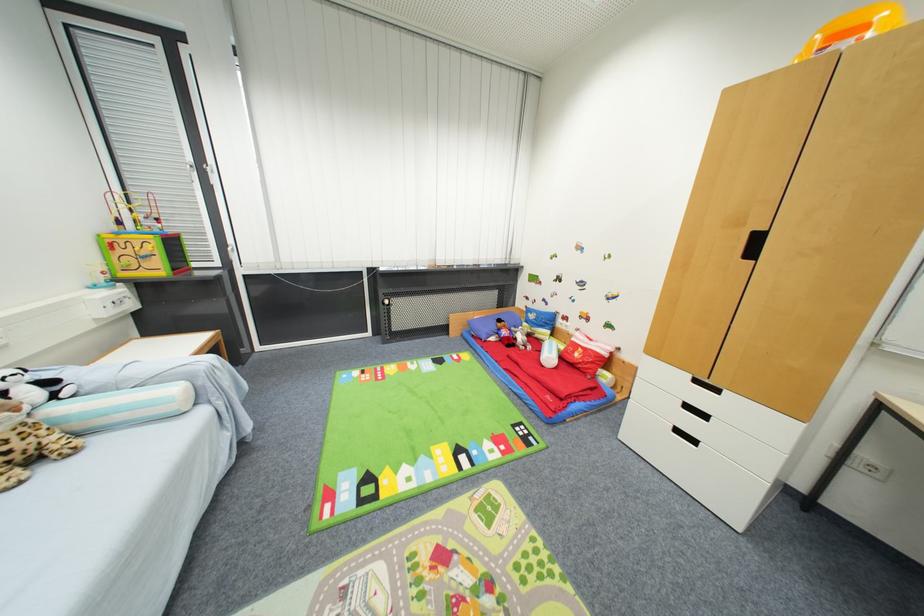
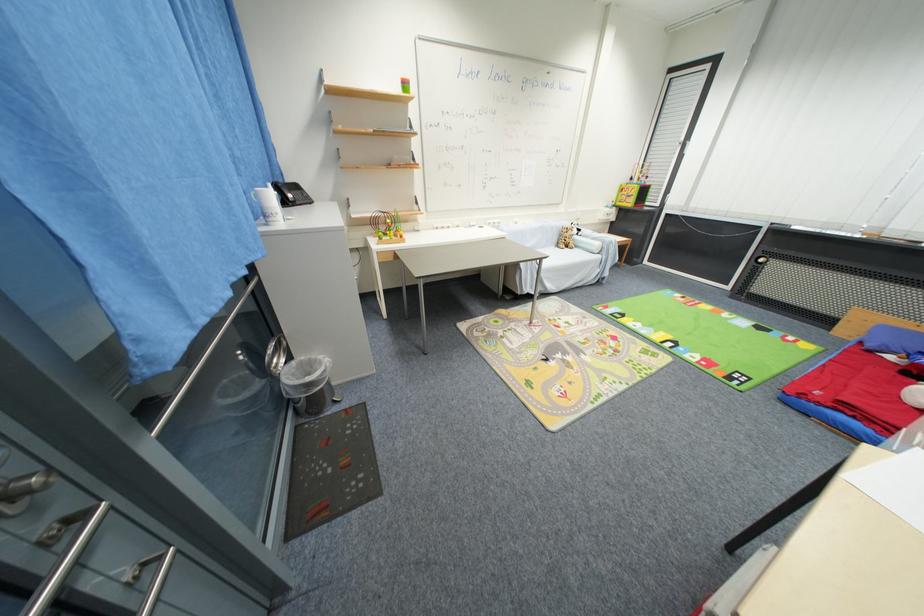
The point at (52, 471) is marked in the first image. Where is the corresponding point in the second image?

(572, 251)